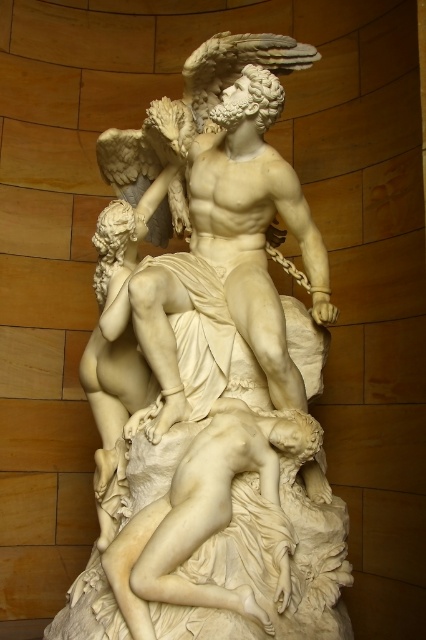
You are standing in front of a classical marble sculpture. The sculpture is located at coordinates point 0.591, 0.488. Can you confirm if the white marble sculpture at center is positioned exactly at those coordinates?

Yes, the white marble sculpture at center is located at point (207, 378).